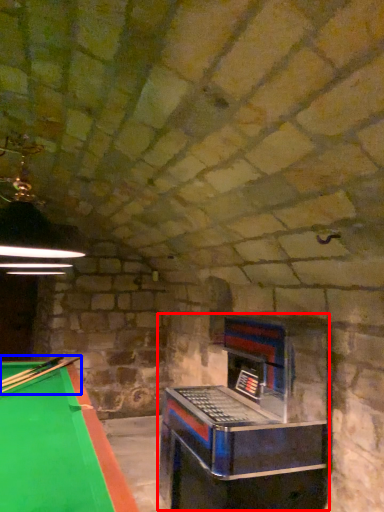
Question: Which object appears farthest to the camera in this image, slot machine (highlighted by a red box) or cue (highlighted by a blue box)?

Choices:
 (A) slot machine
 (B) cue

Answer: (B)